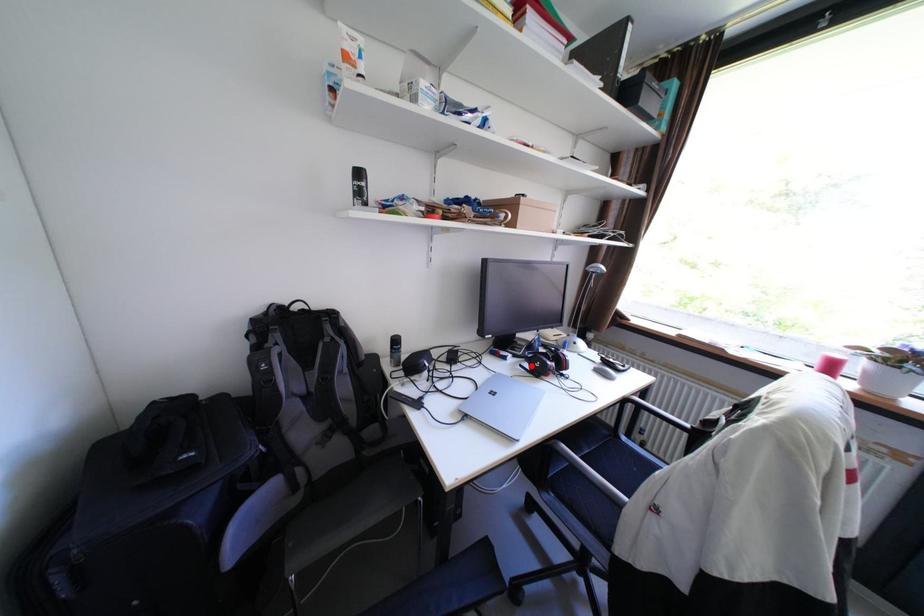
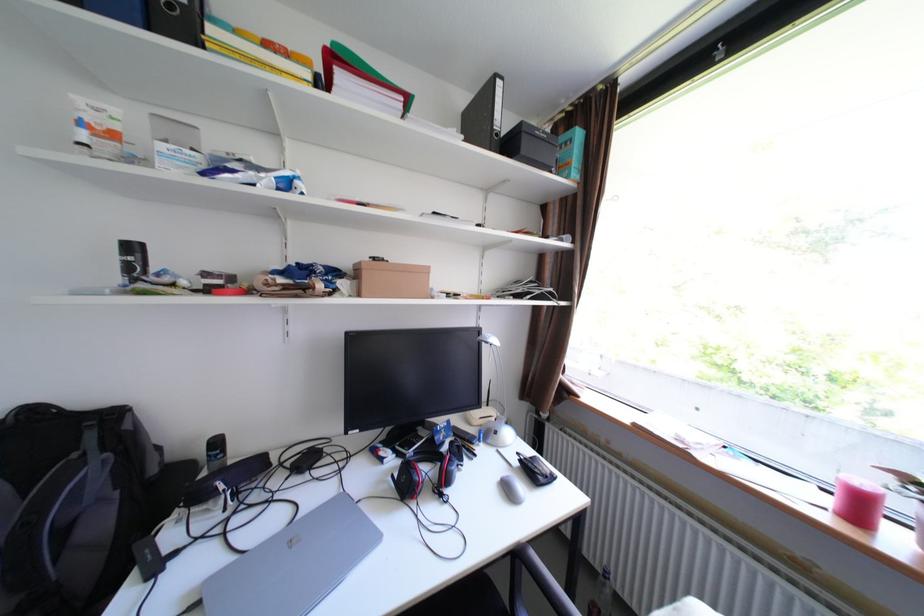
The point at the highlighted location is marked in the first image. Where is the corresponding point in the second image?

(403, 477)